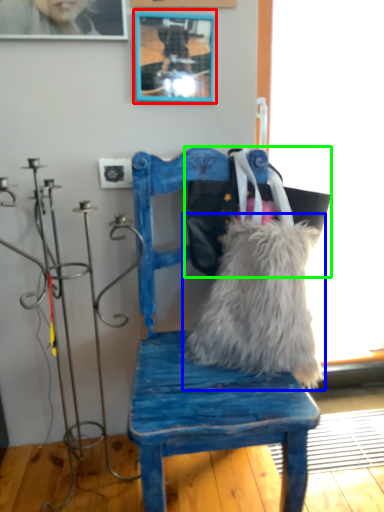
Question: Based on their relative distances, which object is nearer to picture frame (highlighted by a red box)? Choose from pillow (highlighted by a blue box) and messenger bag (highlighted by a green box).

Choices:
 (A) pillow
 (B) messenger bag

Answer: (B)